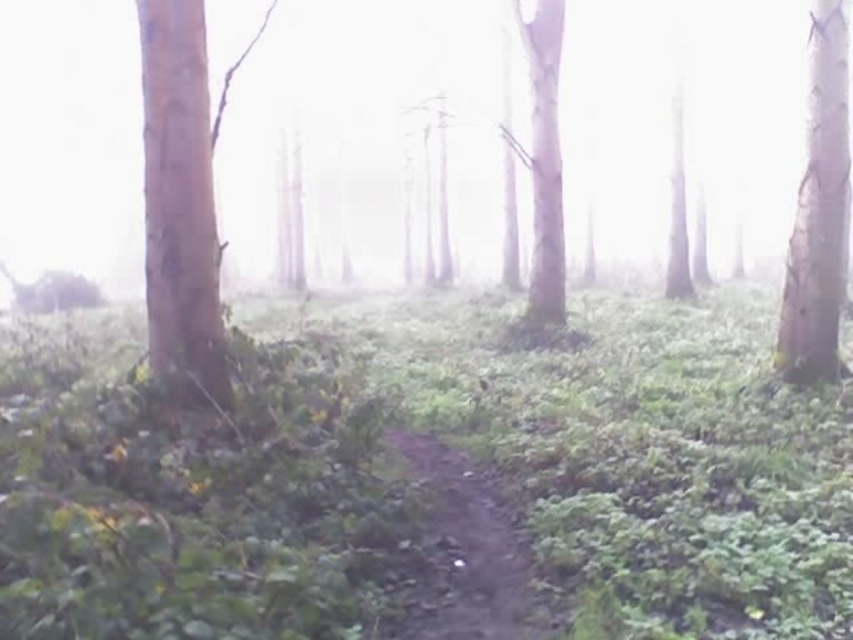
You are a hiker walking along the narrow dirt path in the center of the forest scene. You notice two points marked on your map. The first is at point (529, 561) and the second is at point (815, 13). Which point is closer to you as you walk along the path?

Point (529, 561) is in front of point (815, 13), so the first point is closer to you as you walk along the path.

You are a hiker walking along the path in the forest scene. You see the foggy translucent forest at center and the smooth brown tree trunk at left. Which object is closer to you as you walk along the path?

The smooth brown tree trunk at left is closer to you as you walk along the path because the foggy translucent forest at center is further away from the viewer.